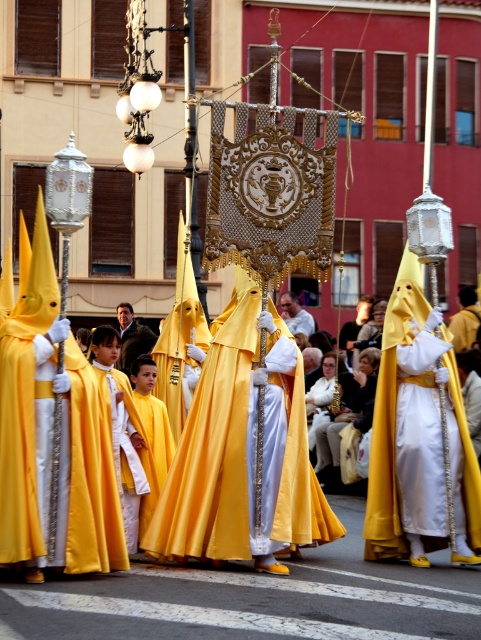
You are a photographer standing at the street level, and you want to take a closeup photo of the matte gold robe at center. Considering your camera has a maximum zoom range of 50 meters, can you capture the robe clearly?

The matte gold robe at center is 47.73 meters away from the viewer. Since the camera can zoom up to 50 meters, it is within range to capture the robe clearly.

You are a photographer trying to capture the procession. You notice the satin yellow robe at center and the matte white robe at center. Which robe should you zoom in on to get a wider shot without moving your camera?

The satin yellow robe at center has a larger width than the matte white robe at center, so zooming in on the satin yellow robe at center will allow you to capture a wider shot without moving the camera.

From the picture: You are a photographer standing at the point marked by coordinates point (241, 451). You want to take a picture of the satin yellow robe at center. Since you are at the point, can you see the satin yellow robe at center clearly?

Yes, because the point (241, 451) indicates the location of the satin yellow robe at center, so you are directly at its position and can see it clearly.